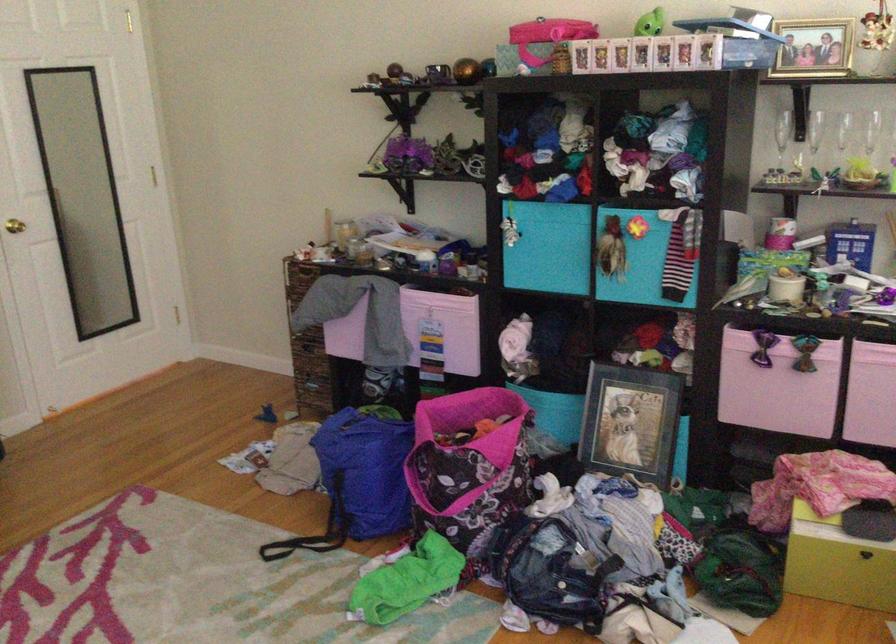
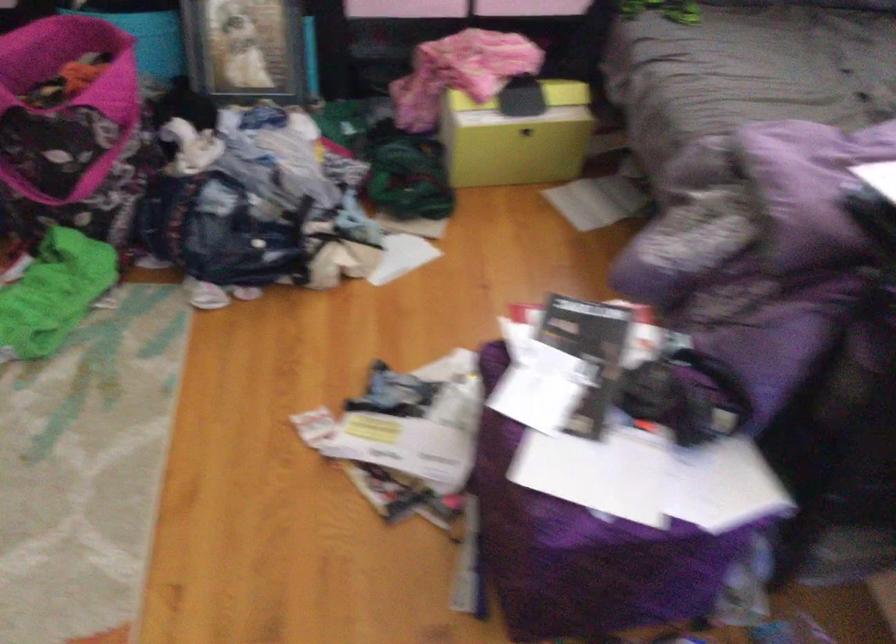
In the second image, find the point that corresponds to [504,427] in the first image.

(124, 67)